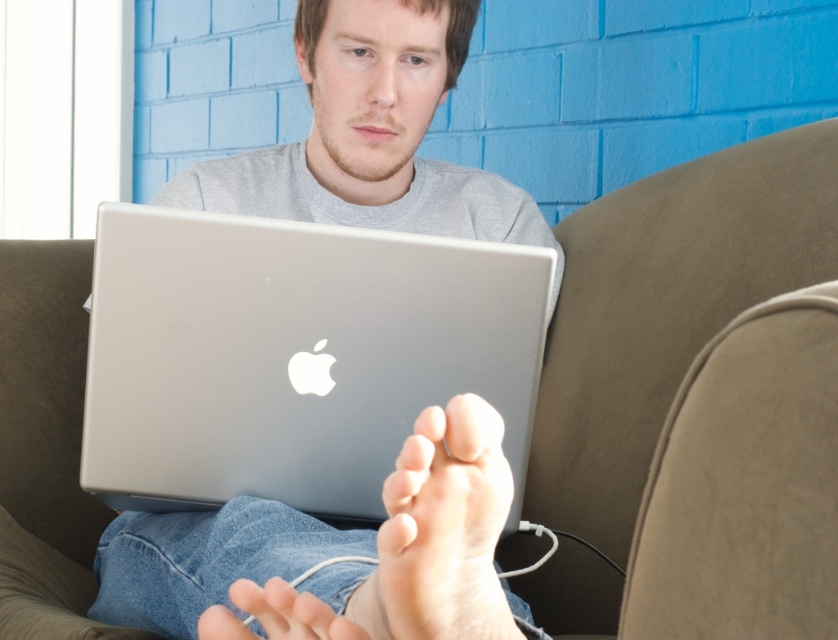
You are a delivery person trying to place a small package on the couch where the silver metallic laptop at center and the pale skin foot at lower center are located. Can you place the package between them without moving either object?

The silver metallic laptop at center is much taller than the pale skin foot at lower center. Since the laptop is taller, there might not be enough vertical space between them to place the package. However, horizontally, there could be space depending on their positions. But since the question only mentions height, it might not fit vertically.

You are a delivery robot that needs to place a small package between the silver metallic laptop at center and the pale skin foot at lower center. The package is 12 inches long. Can you fit it in the space between them?

The silver metallic laptop at center is 13.55 inches from the pale skin foot at lower center. Since the package is 12 inches long, it can fit in the space between them as there is enough room.